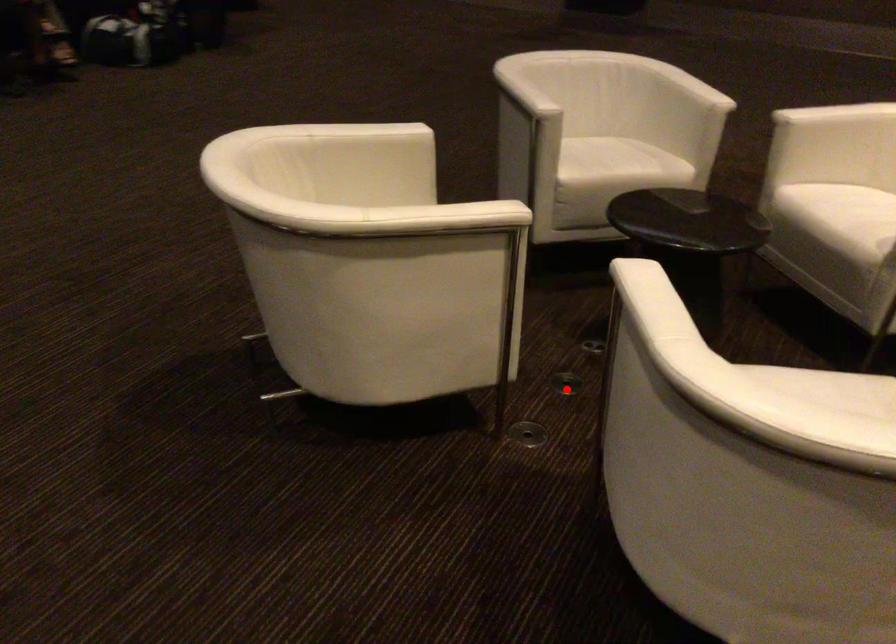
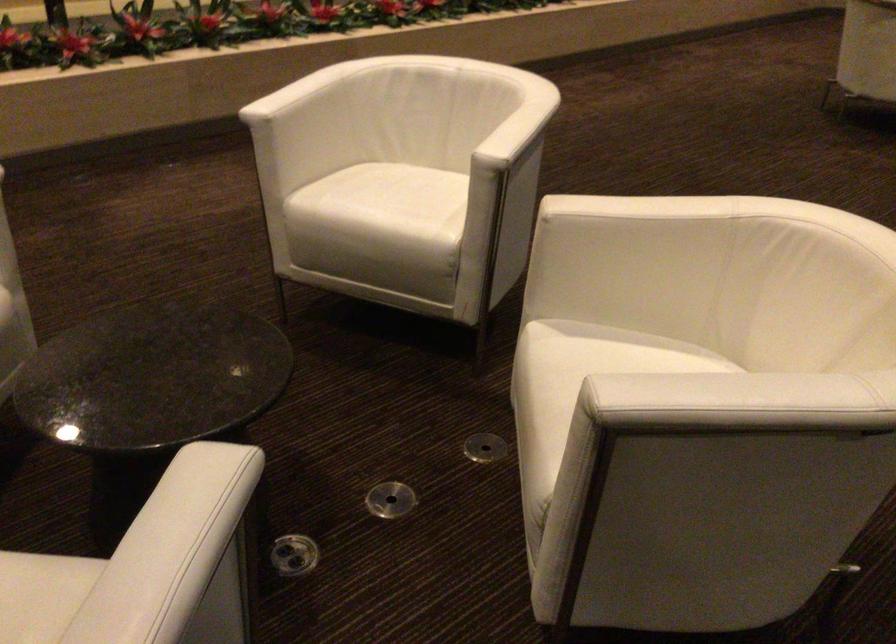
Where in the second image is the point corresponding to the highlighted location from the first image?

(391, 500)